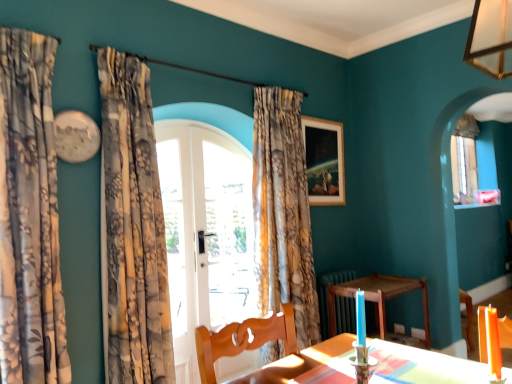
The image size is (512, 384). I want to click on orange wax candle at lower right, so click(x=490, y=342).

Locate an element on the screen. The height and width of the screenshot is (384, 512). floral fabric curtain at center, positioned as the third curtain in left-to-right order is located at coordinates (283, 212).

The width and height of the screenshot is (512, 384). What do you see at coordinates (132, 229) in the screenshot?
I see `floral fabric curtain at left, which is counted as the 2th curtain, starting from the back` at bounding box center [132, 229].

Image resolution: width=512 pixels, height=384 pixels. Find the location of `floral fabric curtain at left, the third curtain positioned from the back`. floral fabric curtain at left, the third curtain positioned from the back is located at coordinates (29, 215).

Is floral fabric curtain at left, the third curtain positioned from the back, in front of or behind floral fabric curtain at center, positioned as the third curtain in left-to-right order, in the image?

floral fabric curtain at left, the third curtain positioned from the back, is positioned closer to the viewer than floral fabric curtain at center, positioned as the third curtain in left-to-right order.

Do you think floral fabric curtain at left, arranged as the 3th curtain when viewed from the right, is within floral fabric curtain at center, which ranks as the third curtain in front-to-back order, or outside of it?

floral fabric curtain at left, arranged as the 3th curtain when viewed from the right, is not inside floral fabric curtain at center, which ranks as the third curtain in front-to-back order, it's outside.

In terms of height, does floral fabric curtain at left, the third curtain positioned from the back, look taller or shorter compared to floral fabric curtain at center, marked as the 1th curtain in a right-to-left arrangement?

Considering their sizes, floral fabric curtain at left, the third curtain positioned from the back, has less height than floral fabric curtain at center, marked as the 1th curtain in a right-to-left arrangement.

Which point is more distant from viewer, [55,274] or [297,279]?

The point [297,279] is farther.

Considering the relative sizes of orange wax candle at lower right and floral fabric curtain at left, the second curtain when ordered from front to back, in the image provided, is orange wax candle at lower right thinner than floral fabric curtain at left, the second curtain when ordered from front to back,?

Correct, the width of orange wax candle at lower right is less than that of floral fabric curtain at left, the second curtain when ordered from front to back.

Is orange wax candle at lower right next to floral fabric curtain at left, the second curtain when ordered from front to back?

No, orange wax candle at lower right is not next to floral fabric curtain at left, the second curtain when ordered from front to back.

Based on the photo, which is more to the right, orange wax candle at lower right or floral fabric curtain at left, arranged as the second curtain when viewed from the right?

From the viewer's perspective, orange wax candle at lower right appears more on the right side.

Between orange wax candle at lower right and floral fabric curtain at left, the 2th curtain from the left, which one has more height?

floral fabric curtain at left, the 2th curtain from the left.

Are wooden picture frame at upper center and clear glass door at center far apart?

No, wooden picture frame at upper center is not far away from clear glass door at center.

From a real-world perspective, relative to clear glass door at center, is wooden picture frame at upper center vertically above or below?

In terms of real-world spatial position, wooden picture frame at upper center is above clear glass door at center.

Find the location of a particular element. The height and width of the screenshot is (384, 512). window below the wooden picture frame at upper center (from a real-world perspective) is located at coordinates (228, 234).

Is wooden picture frame at upper center aimed at clear glass door at center?

No, wooden picture frame at upper center does not turn towards clear glass door at center.

Is clear glass door at center completely or partially inside floral fabric curtain at left, the 2th curtain from the left?

Actually, clear glass door at center is outside floral fabric curtain at left, the 2th curtain from the left.

Measure the distance between floral fabric curtain at left, arranged as the second curtain when viewed from the right, and clear glass door at center.

A distance of 32.80 inches exists between floral fabric curtain at left, arranged as the second curtain when viewed from the right, and clear glass door at center.

Identify the location of window that is under the floral fabric curtain at left, the 2th curtain from the left (from a real-world perspective). The height and width of the screenshot is (384, 512). (228, 234).

Based on the photo, can you tell me how much floral fabric curtain at left, arranged as the second curtain when viewed from the right, and clear glass door at center differ in facing direction?

The angle between the facing direction of floral fabric curtain at left, arranged as the second curtain when viewed from the right, and the facing direction of clear glass door at center is 0.115 degrees.

In the scene shown: Does clear glass door at center come in front of wooden table at lower center?

That is False.

From a real-world perspective, is clear glass door at center positioned under wooden table at lower center based on gravity?

No, from a real-world perspective, clear glass door at center is not under wooden table at lower center.

Does point (206, 246) come behind point (385, 287)?

Yes, point (206, 246) is farther from viewer.

This screenshot has width=512, height=384. I want to click on table on the right of clear glass door at center, so click(379, 298).

Between wooden picture frame at upper center and floral fabric curtain at left, arranged as the second curtain when viewed from the right, which one is positioned in front?

floral fabric curtain at left, arranged as the second curtain when viewed from the right, is more forward.

Considering the sizes of objects wooden picture frame at upper center and floral fabric curtain at left, arranged as the second curtain when viewed from the right, in the image provided, who is bigger, wooden picture frame at upper center or floral fabric curtain at left, arranged as the second curtain when viewed from the right,?

floral fabric curtain at left, arranged as the second curtain when viewed from the right.

Which is more distant, (x=302, y=116) or (x=127, y=310)?

Point (x=302, y=116)

Is wooden picture frame at upper center positioned far away from floral fabric curtain at left, arranged as the second curtain when viewed from the right?

wooden picture frame at upper center is positioned a significant distance from floral fabric curtain at left, arranged as the second curtain when viewed from the right.

Is floral fabric curtain at left, the 1th curtain positioned from the left, at the left side of wooden picture frame at upper center?

Correct, you'll find floral fabric curtain at left, the 1th curtain positioned from the left, to the left of wooden picture frame at upper center.

Image resolution: width=512 pixels, height=384 pixels. What are the coordinates of `the 3rd curtain to the left of the wooden picture frame at upper center, starting your count from the anchor` in the screenshot? It's located at (29, 215).

Is wooden picture frame at upper center located within floral fabric curtain at left, the third curtain positioned from the back?

No, wooden picture frame at upper center is not surrounded by floral fabric curtain at left, the third curtain positioned from the back.

Is floral fabric curtain at left, arranged as the 3th curtain when viewed from the right, wider than wooden picture frame at upper center?

Indeed, floral fabric curtain at left, arranged as the 3th curtain when viewed from the right, has a greater width compared to wooden picture frame at upper center.

The height and width of the screenshot is (384, 512). Find the location of `the 2nd curtain to the left of the floral fabric curtain at center, the 1th curtain in the back-to-front sequence, counting from the anchor's position`. the 2nd curtain to the left of the floral fabric curtain at center, the 1th curtain in the back-to-front sequence, counting from the anchor's position is located at coordinates (29, 215).

Where is `candle that appears in front of the floral fabric curtain at left, the second curtain when ordered from front to back`? The width and height of the screenshot is (512, 384). candle that appears in front of the floral fabric curtain at left, the second curtain when ordered from front to back is located at coordinates (490, 342).

Looking at the image, which one is located closer to floral fabric curtain at left, arranged as the 3th curtain when viewed from the right, wooden table at lower center or wooden picture frame at upper center?

Among the two, wooden picture frame at upper center is located nearer to floral fabric curtain at left, arranged as the 3th curtain when viewed from the right.

Estimate the real-world distances between objects in this image. Which object is further from wooden picture frame at upper center, wooden table at lower center or floral fabric curtain at center, marked as the 1th curtain in a right-to-left arrangement?

The object further to wooden picture frame at upper center is wooden table at lower center.

Looking at the image, which one is located closer to floral fabric curtain at left, the second curtain when ordered from front to back, orange wax candle at lower right or floral fabric curtain at left, acting as the first curtain starting from the front?

floral fabric curtain at left, acting as the first curtain starting from the front, is closer to floral fabric curtain at left, the second curtain when ordered from front to back.

Based on their spatial positions, is orange wax candle at lower right or floral fabric curtain at left, the 2th curtain from the left, closer to clear glass door at center?

floral fabric curtain at left, the 2th curtain from the left.

From the picture: Which object lies further to the anchor point floral fabric curtain at left, arranged as the 3th curtain when viewed from the right, orange wax candle at lower right or wooden picture frame at upper center?

wooden picture frame at upper center is positioned further to the anchor floral fabric curtain at left, arranged as the 3th curtain when viewed from the right.

Considering their positions, is wooden picture frame at upper center positioned further to floral fabric curtain at left, the 2th curtain from the left, than floral fabric curtain at left, acting as the first curtain starting from the front?

wooden picture frame at upper center is further to floral fabric curtain at left, the 2th curtain from the left.

Looking at the image, which one is located closer to wooden picture frame at upper center, clear glass door at center or floral fabric curtain at center, marked as the 1th curtain in a right-to-left arrangement?

Among the two, floral fabric curtain at center, marked as the 1th curtain in a right-to-left arrangement, is located nearer to wooden picture frame at upper center.

Which object lies nearer to the anchor point orange wax candle at lower right, clear glass door at center or floral fabric curtain at left, the second curtain when ordered from front to back?

floral fabric curtain at left, the second curtain when ordered from front to back, is positioned closer to the anchor orange wax candle at lower right.

The height and width of the screenshot is (384, 512). In order to click on window between floral fabric curtain at left, the second curtain when ordered from front to back, and wooden picture frame at upper center from front to back in this screenshot , I will do `click(228, 234)`.

I want to click on picture frame situated between floral fabric curtain at left, the 1th curtain positioned from the left, and wooden table at lower center from left to right, so click(x=324, y=161).

You are a GUI agent. You are given a task and a screenshot of the screen. Output one action in this format:
    pyautogui.click(x=<x>, y=<y>)
    Task: Click on the window between wooden picture frame at upper center and wooden table at lower center in the vertical direction
    Image resolution: width=512 pixels, height=384 pixels.
    Given the screenshot: What is the action you would take?
    pyautogui.click(x=228, y=234)

Find the location of `table positioned between orange wax candle at lower right and clear glass door at center from near to far`. table positioned between orange wax candle at lower right and clear glass door at center from near to far is located at coordinates (379, 298).